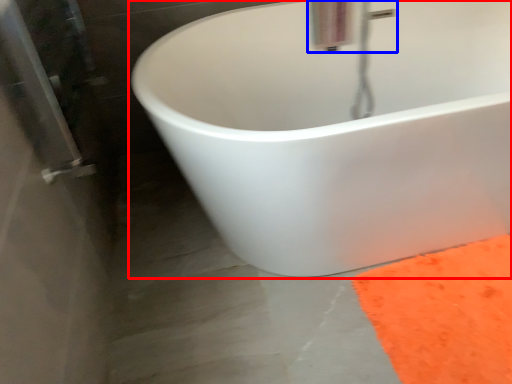
Question: Which object is further to the camera taking this photo, bathtub (highlighted by a red box) or plumbing fixture (highlighted by a blue box)?

Choices:
 (A) bathtub
 (B) plumbing fixture

Answer: (B)